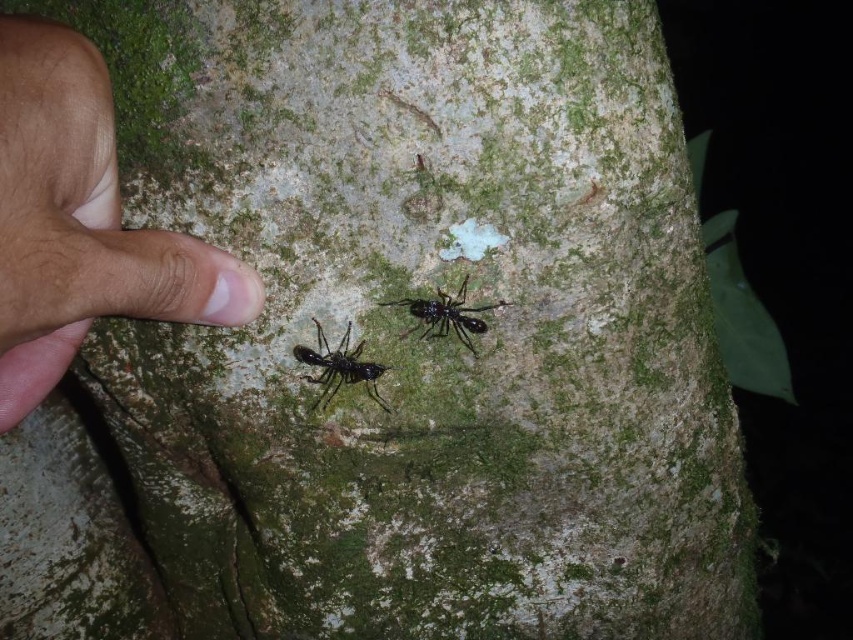
Which is above, brown skin at left or black glossy ant at lower left?

Positioned higher is brown skin at left.

What do you see at coordinates (80, 221) in the screenshot?
I see `brown skin at left` at bounding box center [80, 221].

Is point (7, 429) closer to viewer compared to point (310, 355)?

Yes, it is in front of point (310, 355).

Where is `brown skin at left`? The width and height of the screenshot is (853, 640). brown skin at left is located at coordinates (80, 221).

Who is more distant from viewer, [106,84] or [465,332]?

Point [465,332]

Does point (73, 257) come in front of point (399, 301)?

Yes, point (73, 257) is in front of point (399, 301).

At what (x,y) coordinates should I click in order to perform the action: click on brown skin at left. Please return your answer as a coordinate pair (x, y). Looking at the image, I should click on (80, 221).

Between black glossy ant at lower left and black glossy ant at center, which one has more height?

Standing taller between the two is black glossy ant at lower left.

Consider the image. Can you confirm if black glossy ant at lower left is taller than black glossy ant at center?

Yes.

Between point (332, 365) and point (439, 291), which one is positioned in front?

Positioned in front is point (439, 291).

Locate an element on the screen. The image size is (853, 640). black glossy ant at lower left is located at coordinates (339, 365).